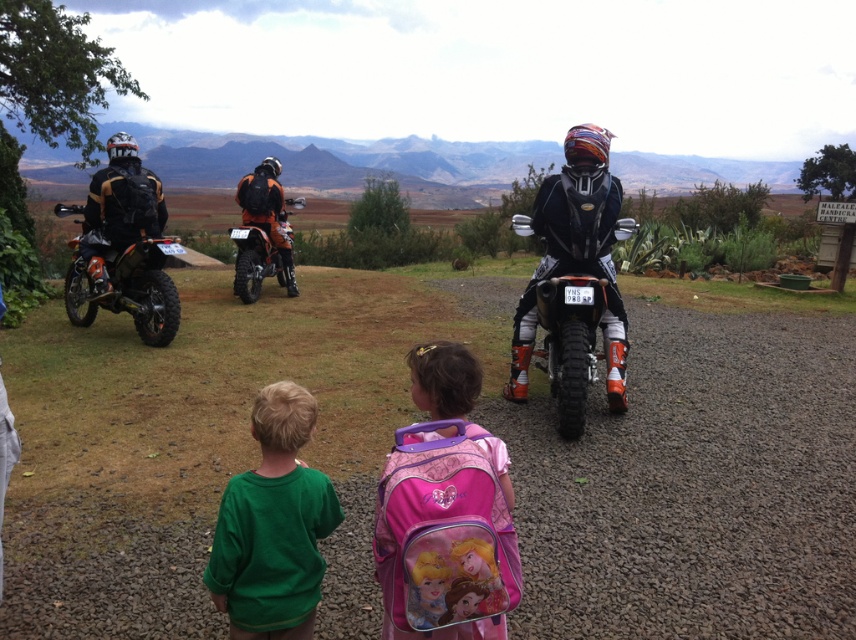
Between dirt/gravel road at center and pink fabric backpack at center, which one has less height?

pink fabric backpack at center

Is dirt/gravel road at center closer to the viewer compared to pink fabric backpack at center?

That is False.

Between point (640, 355) and point (382, 509), which one is positioned in front?

Point (382, 509)

Identify the location of dirt/gravel road at center. (419, 417).

Between matte black motorcycle at center and orange matte/black textured motorcycle at center, which one has more height?

matte black motorcycle at center

Can you confirm if matte black motorcycle at center is wider than orange matte/black textured motorcycle at center?

Correct, the width of matte black motorcycle at center exceeds that of orange matte/black textured motorcycle at center.

Between point (603, 292) and point (286, 284), which one is positioned behind?

Point (286, 284)

This screenshot has height=640, width=856. I want to click on matte black motorcycle at center, so click(569, 340).

Is dirt/gravel road at center further to camera compared to green cotton shirt at lower left?

Yes, dirt/gravel road at center is further from the viewer.

What do you see at coordinates (419, 417) in the screenshot? I see `dirt/gravel road at center` at bounding box center [419, 417].

Does point (134, 406) come closer to viewer compared to point (235, 483)?

No, (134, 406) is behind (235, 483).

The image size is (856, 640). Identify the location of dirt/gravel road at center. (419, 417).